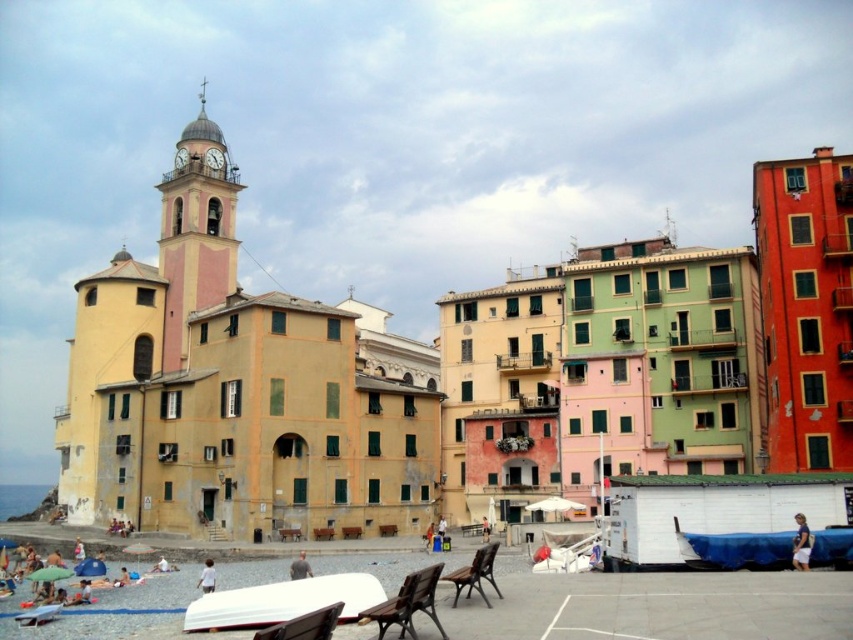
You are a tourist in this coastal town and you see a white cotton shirt at lower right and a white fabric umbrella at lower left. Which item is closer to you?

The white cotton shirt at lower right is closer because it is in front of the white fabric umbrella at lower left.

You are a tourist in this coastal town and want to choose an umbrella to sit under. The white fabric umbrella at lower left and the white fabric umbrella at center are both available. Which one offers more shade coverage?

The white fabric umbrella at lower left offers more shade coverage because its width surpasses that of the white fabric umbrella at center.

You are a photographer planning to capture a scene that includes both the white cotton shirt at lower right and the smooth skin person at lower center. Given their sizes, which object would you need to position closer to the camera to ensure both fit well in the frame?

The white cotton shirt at lower right occupies less space than the smooth skin person at lower center, so you would need to position the white cotton shirt at lower right closer to the camera to ensure both fit well in the frame.